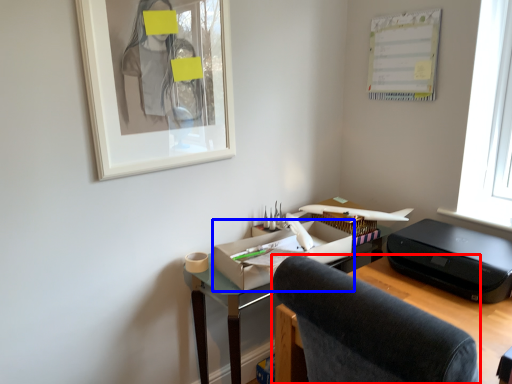
Question: Which object is closer to the camera taking this photo, chair (highlighted by a red box) or office supplies (highlighted by a blue box)?

Choices:
 (A) chair
 (B) office supplies

Answer: (A)